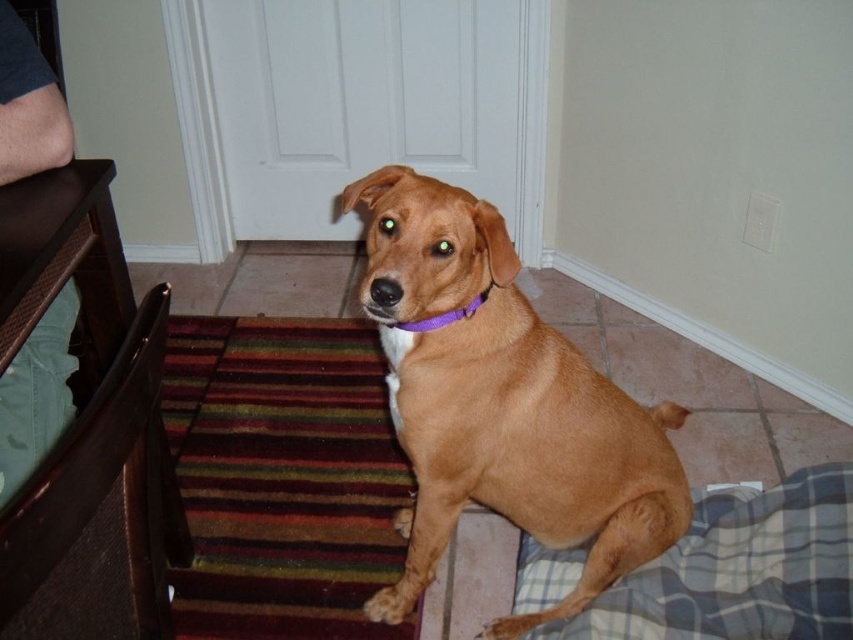
Is brown matte dog at center thinner than plaid fabric dog bed at lower right?

Yes, brown matte dog at center is thinner than plaid fabric dog bed at lower right.

Is brown matte dog at center above plaid fabric dog bed at lower right?

Indeed, brown matte dog at center is positioned over plaid fabric dog bed at lower right.

Find the location of a particular element. brown matte dog at center is located at coordinates (502, 404).

Looking at this image, is brown matte dog at center above brown leather chair at lower left?

Yes.

The image size is (853, 640). What do you see at coordinates (502, 404) in the screenshot?
I see `brown matte dog at center` at bounding box center [502, 404].

You are a GUI agent. You are given a task and a screenshot of the screen. Output one action in this format:
    pyautogui.click(x=<x>, y=<y>)
    Task: Click on the brown matte dog at center
    The image size is (853, 640).
    Given the screenshot: What is the action you would take?
    pyautogui.click(x=502, y=404)

Is point (107, 618) positioned before point (427, 324)?

That is True.

Which is more to the left, brown leather chair at lower left or purple fabric neckband at center?

brown leather chair at lower left is more to the left.

Does point (57, 477) come farther from viewer compared to point (450, 316)?

No.

This screenshot has height=640, width=853. Find the location of `brown leather chair at lower left`. brown leather chair at lower left is located at coordinates (96, 509).